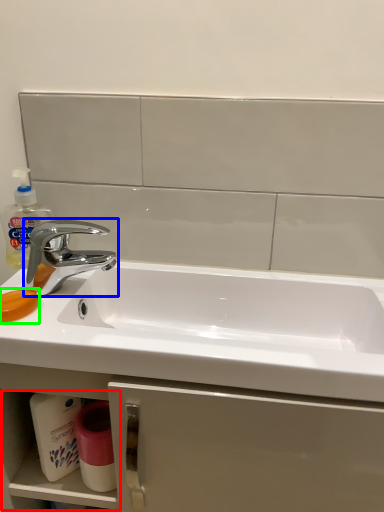
Question: Based on their relative distances, which object is farther from shelf (highlighted by a red box)? Choose from tap (highlighted by a blue box) and soap (highlighted by a green box).

Choices:
 (A) tap
 (B) soap

Answer: (B)